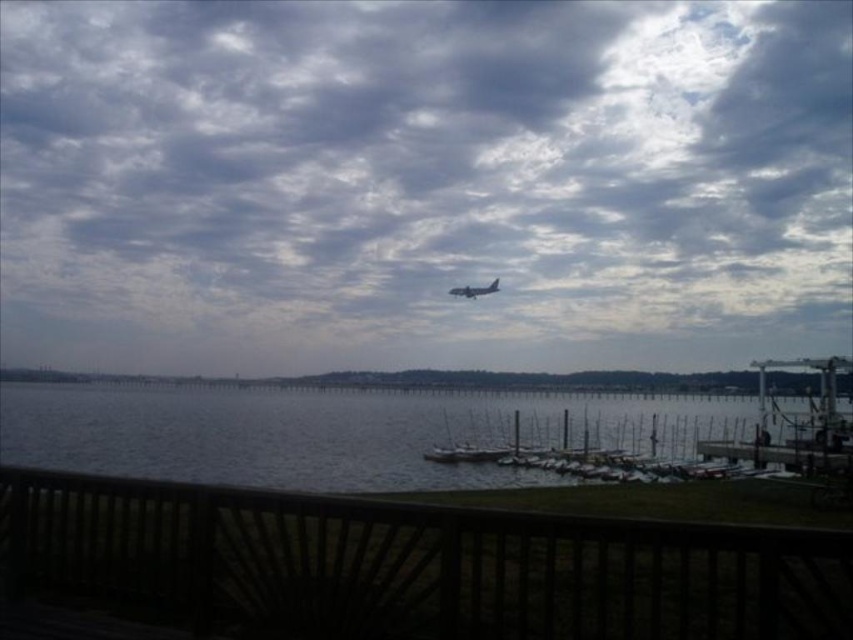
Question: Which point is closer to the camera?

Choices:
 (A) wooden dock at lower right
 (B) gray water at lower center
 (C) cloudy sky at upper center
 (D) metallic silver airplane at upper center

Answer: (A)

Question: Which point appears closest to the camera in this image?

Choices:
 (A) (473, 296)
 (B) (804, 456)

Answer: (B)

Question: Observing the image, what is the correct spatial positioning of gray water at lower center in reference to metallic silver airplane at upper center?

Choices:
 (A) right
 (B) left

Answer: (B)

Question: Which point is farther from the camera taking this photo?

Choices:
 (A) (846, 467)
 (B) (460, 292)
 (C) (758, 99)
 (D) (196, 452)

Answer: (C)

Question: Can you confirm if wooden dock at lower right is smaller than metallic silver airplane at upper center?

Choices:
 (A) yes
 (B) no

Answer: (B)

Question: Can you confirm if gray water at lower center is positioned to the left of metallic silver airplane at upper center?

Choices:
 (A) no
 (B) yes

Answer: (B)